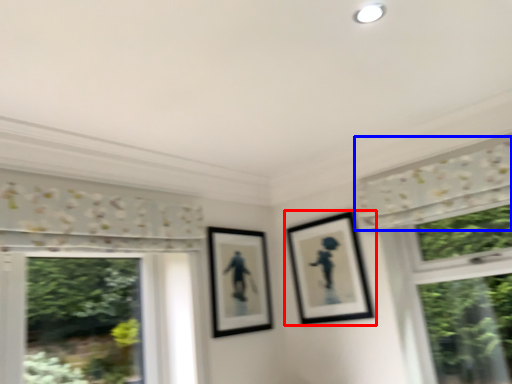
Question: Which object is further to the camera taking this photo, picture frame (highlighted by a red box) or curtain (highlighted by a blue box)?

Choices:
 (A) picture frame
 (B) curtain

Answer: (A)